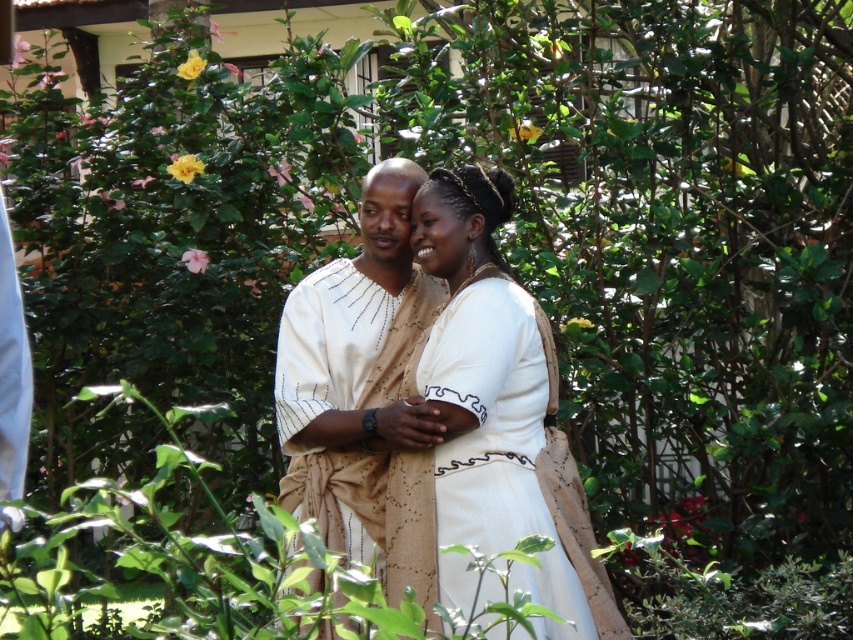
Question: Can you confirm if white textured dress at center is thinner than beige textured robe at center?

Choices:
 (A) yes
 (B) no

Answer: (B)

Question: Is white textured dress at center thinner than beige textured robe at center?

Choices:
 (A) no
 (B) yes

Answer: (A)

Question: Which point is closer to the camera?

Choices:
 (A) white textured dress at center
 (B) beige textured robe at center

Answer: (A)

Question: Which object appears farthest from the camera in this image?

Choices:
 (A) white textured dress at center
 (B) beige textured robe at center

Answer: (B)

Question: Which object appears closest to the camera in this image?

Choices:
 (A) white textured dress at center
 (B) beige textured robe at center

Answer: (A)

Question: Does white textured dress at center appear on the left side of beige textured robe at center?

Choices:
 (A) no
 (B) yes

Answer: (A)